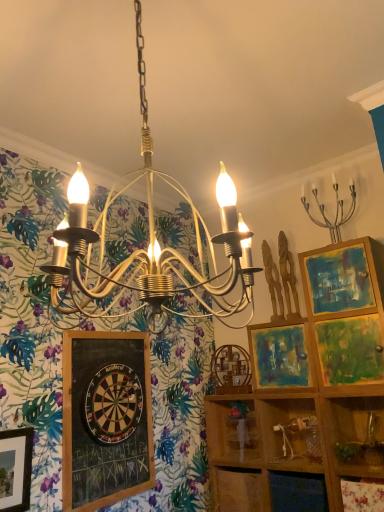
Question: From a real-world perspective, is silver metallic candelabra at upper right located higher than black chalkboard at lower left?

Choices:
 (A) no
 (B) yes

Answer: (B)

Question: Is silver metallic candelabra at upper right oriented away from black chalkboard at lower left?

Choices:
 (A) no
 (B) yes

Answer: (A)

Question: Is silver metallic candelabra at upper right surrounding black chalkboard at lower left?

Choices:
 (A) yes
 (B) no

Answer: (B)

Question: Does silver metallic candelabra at upper right appear on the left side of black chalkboard at lower left?

Choices:
 (A) yes
 (B) no

Answer: (B)

Question: Could you tell me if silver metallic candelabra at upper right is turned towards black chalkboard at lower left?

Choices:
 (A) no
 (B) yes

Answer: (A)

Question: Considering the relative positions of wooden at center and matte wooden picture frame at center right in the image provided, is wooden at center to the left or to the right of matte wooden picture frame at center right?

Choices:
 (A) right
 (B) left

Answer: (B)

Question: Looking at the image, does wooden at center seem bigger or smaller compared to matte wooden picture frame at center right?

Choices:
 (A) big
 (B) small

Answer: (A)

Question: Looking at their shapes, would you say wooden at center is wider or thinner than matte wooden picture frame at center right?

Choices:
 (A) wide
 (B) thin

Answer: (A)

Question: From a real-world perspective, relative to matte wooden picture frame at center right, is wooden at center vertically above or below?

Choices:
 (A) below
 (B) above

Answer: (A)

Question: Would you say clear plastic bottle at lower right, the second cabinet viewed from the left, is inside or outside black chalkboard at lower left?

Choices:
 (A) outside
 (B) inside

Answer: (A)

Question: Based on their positions, is clear plastic bottle at lower right, the 1th cabinet positioned from the right, located to the left or right of black chalkboard at lower left?

Choices:
 (A) right
 (B) left

Answer: (A)

Question: Is clear plastic bottle at lower right, the second cabinet viewed from the left, wider or thinner than black chalkboard at lower left?

Choices:
 (A) wide
 (B) thin

Answer: (A)

Question: In the image, is clear plastic bottle at lower right, the second cabinet viewed from the left, positioned in front of or behind black chalkboard at lower left?

Choices:
 (A) behind
 (B) front

Answer: (A)

Question: Based on their sizes in the image, would you say wooden shelf at lower right is bigger or smaller than wooden at center?

Choices:
 (A) small
 (B) big

Answer: (A)

Question: From a real-world perspective, relative to wooden at center, is wooden shelf at lower right vertically above or below?

Choices:
 (A) below
 (B) above

Answer: (B)